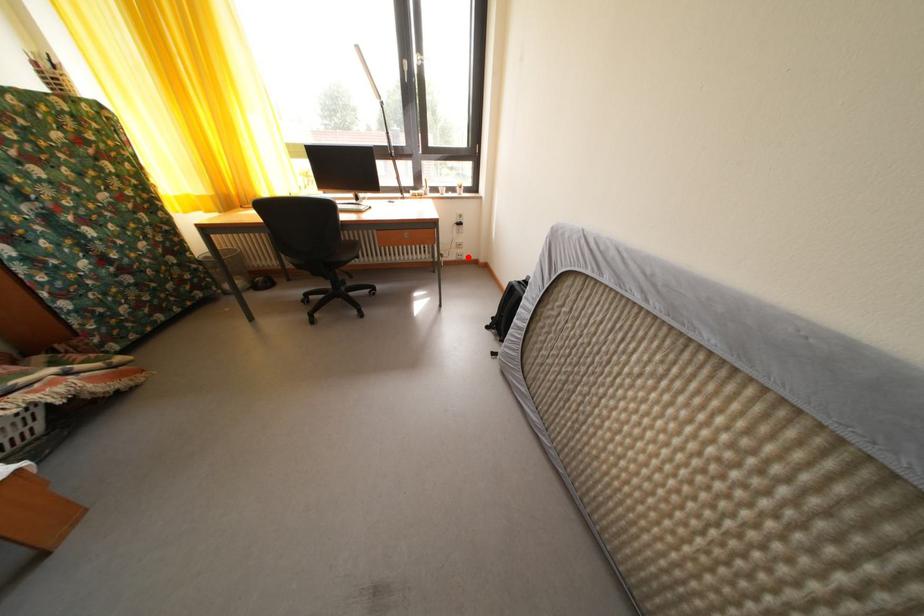
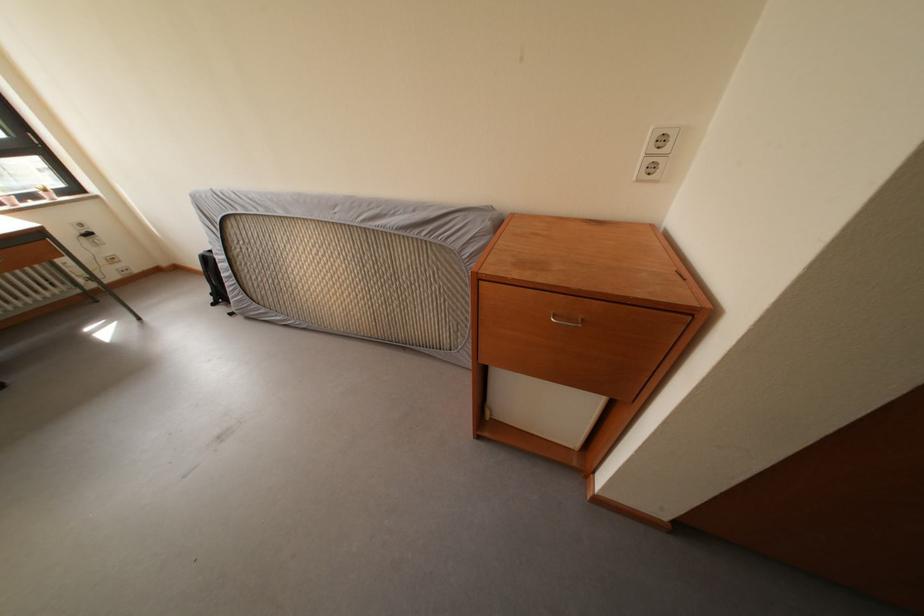
Question: I am providing you with two images of the same scene from different viewpoints. In image1, a red point is highlighted. Considering the same 3D point in image2, which of the following is correct?

Choices:
 (A) It is closer
 (B) It is farther

Answer: (B)